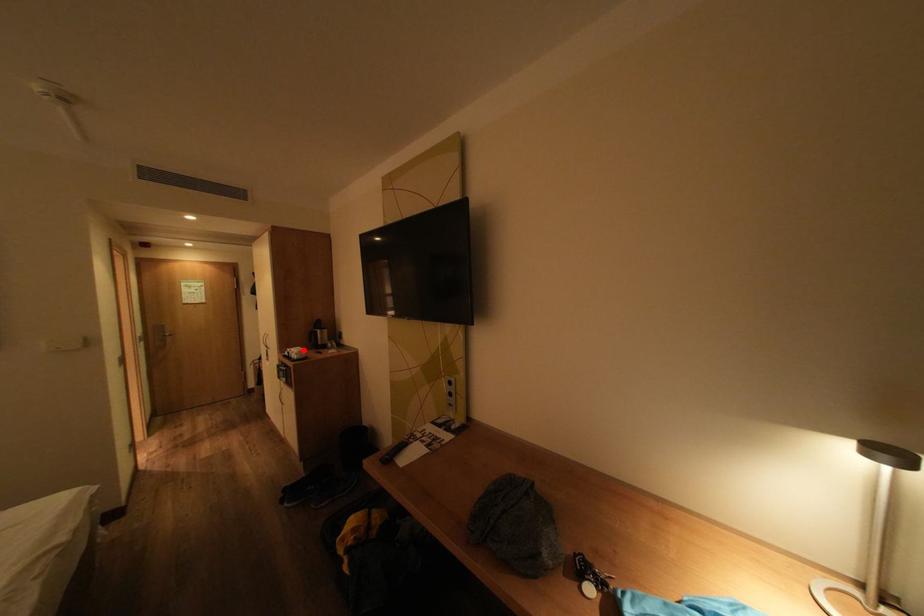
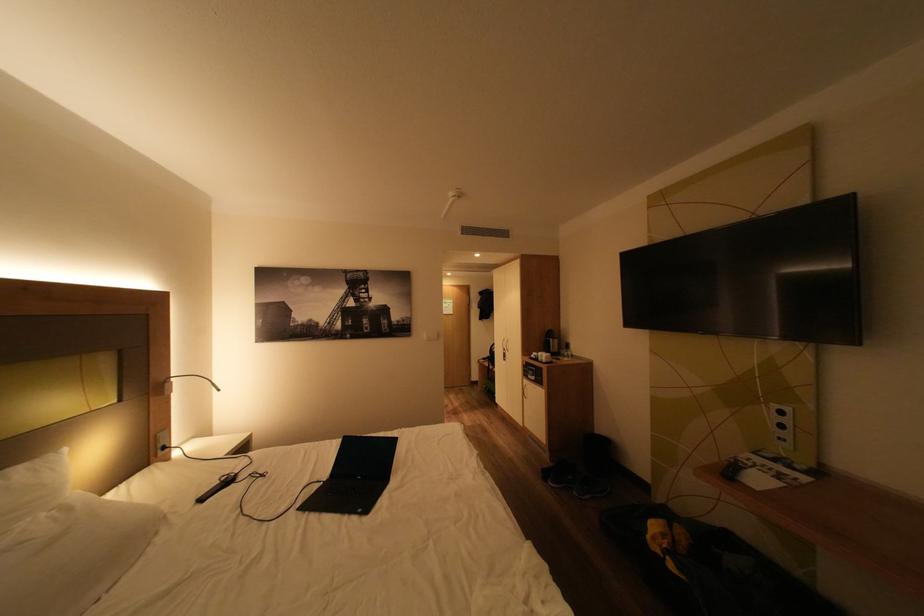
Where in the second image is the point corresponding to the highlighted location from the first image?

(551, 354)